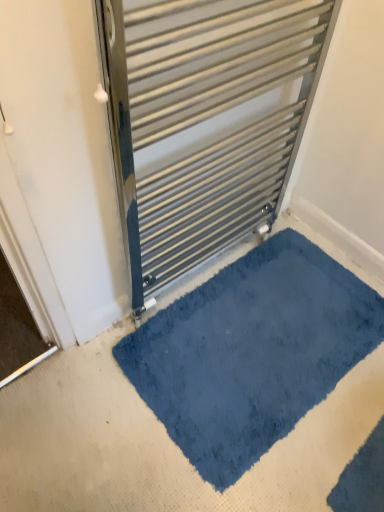
This screenshot has height=512, width=384. I want to click on free point above blue plush bath mat at lower center (from a real-world perspective), so click(290, 309).